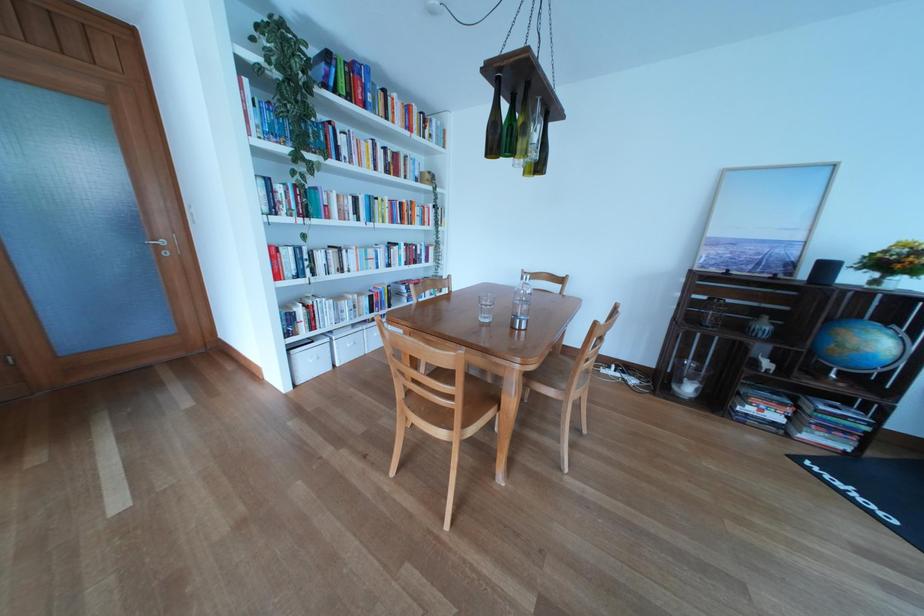
Which object does [520,302] point to?

It corresponds to the glass water bottle in the image.